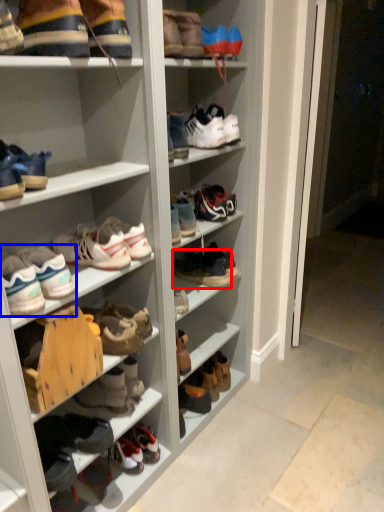
Question: Among these objects, which one is nearest to the camera, footwear (highlighted by a red box) or footwear (highlighted by a blue box)?

Choices:
 (A) footwear
 (B) footwear

Answer: (B)